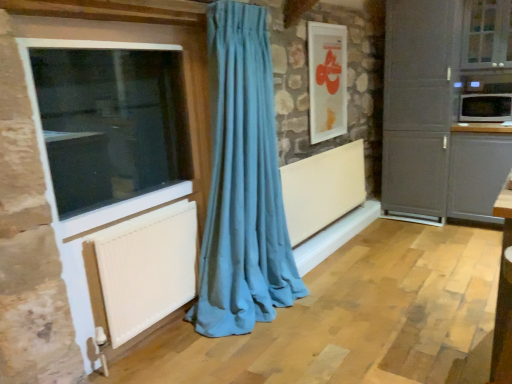
Where is `empty space that is ontop of white plastic window at left, the 1th window from the front (from a real-world perspective)`? empty space that is ontop of white plastic window at left, the 1th window from the front (from a real-world perspective) is located at coordinates (94, 41).